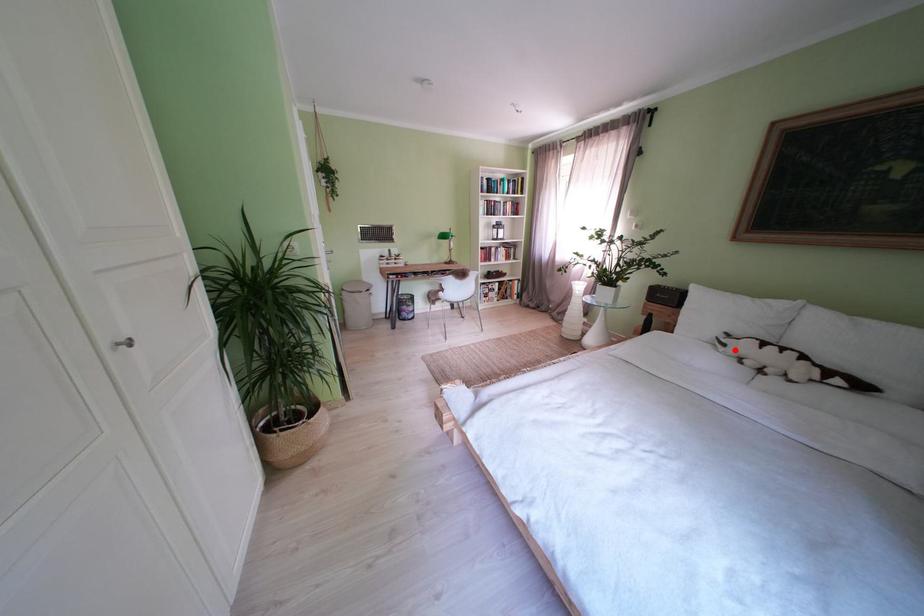
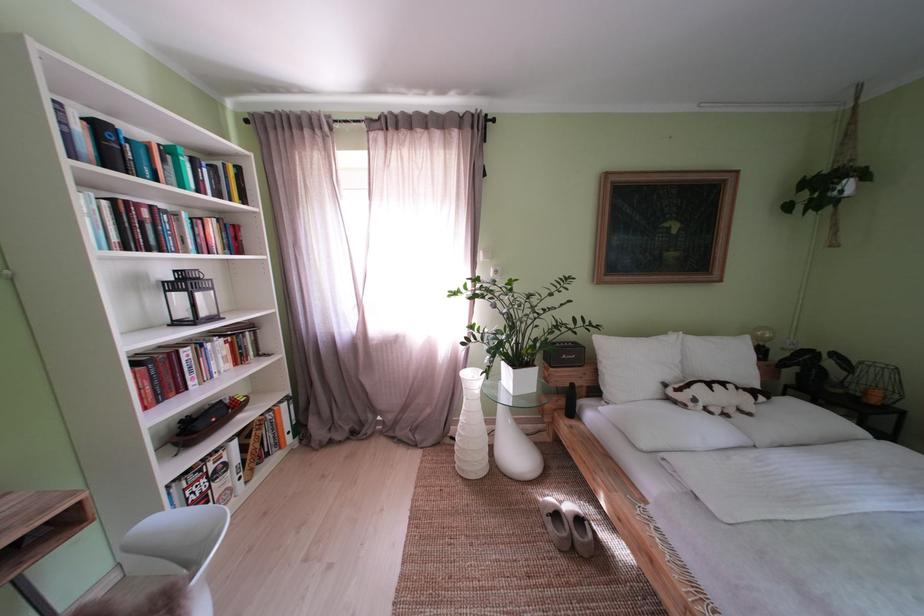
Locate, in the second image, the point that corresponds to the highlighted location in the first image.

(706, 406)